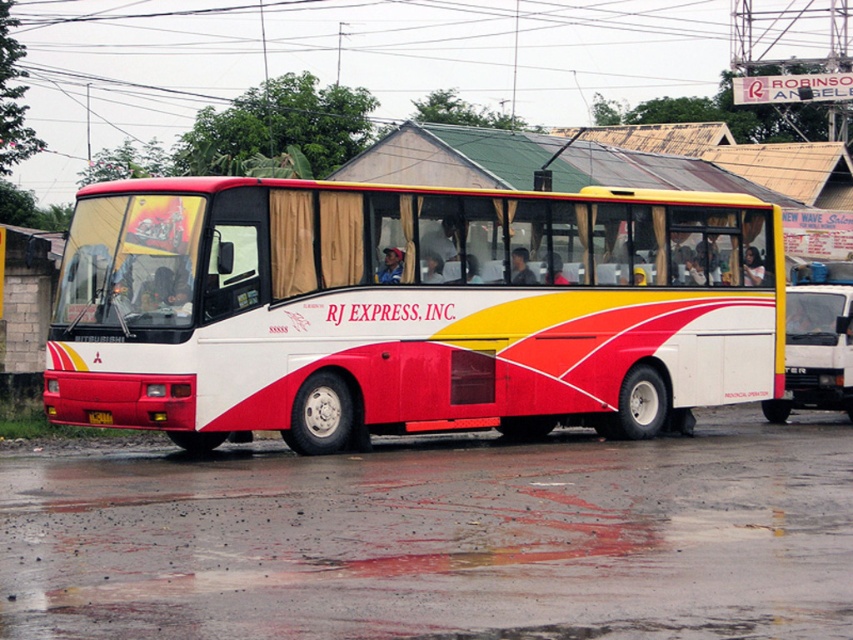
You are standing in front of the RJ EXPRESS, INC. bus and want to touch both the point at coordinates point [218,285] and point [90,412]. Which point should you reach for first?

You should reach for point [218,285] first because it is closer to you than point [90,412].